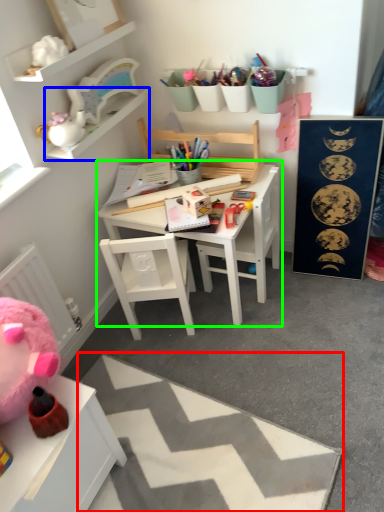
Question: Considering the real-world distances, which object is farthest from plain (highlighted by a red box)? cabinet (highlighted by a blue box) or table (highlighted by a green box)?

Choices:
 (A) cabinet
 (B) table

Answer: (A)